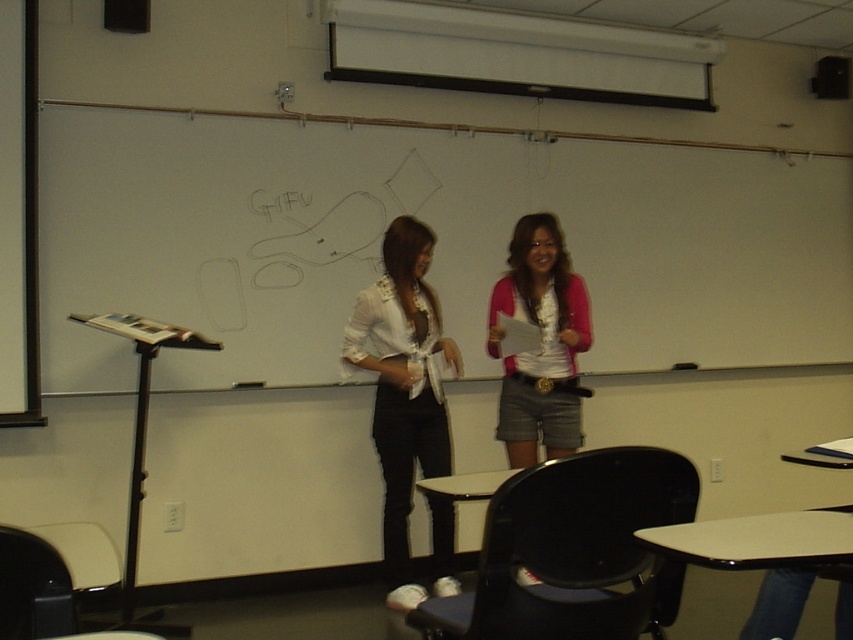
Which is behind, point (430, 349) or point (570, 323)?

Point (430, 349)

Can you confirm if white satin blouse at center is positioned to the left of pink fabric shirt at center?

Indeed, white satin blouse at center is positioned on the left side of pink fabric shirt at center.

The width and height of the screenshot is (853, 640). I want to click on white satin blouse at center, so click(403, 387).

Does white matte whiteboard at center have a lesser width compared to white satin blouse at center?

No.

Does white matte whiteboard at center lie behind white satin blouse at center?

Yes, white matte whiteboard at center is behind white satin blouse at center.

Find the location of `white matte whiteboard at center`. white matte whiteboard at center is located at coordinates (437, 244).

Between white matte whiteboard at center and pink fabric shirt at center, which one has more height?

white matte whiteboard at center

Is point (851, 221) positioned before point (526, 292)?

No, (851, 221) is behind (526, 292).

Does point (712, 189) lie behind point (517, 305)?

Yes, point (712, 189) is behind point (517, 305).

You are a GUI agent. You are given a task and a screenshot of the screen. Output one action in this format:
    pyautogui.click(x=<x>, y=<y>)
    Task: Click on the white matte whiteboard at center
    
    Given the screenshot: What is the action you would take?
    pyautogui.click(x=437, y=244)